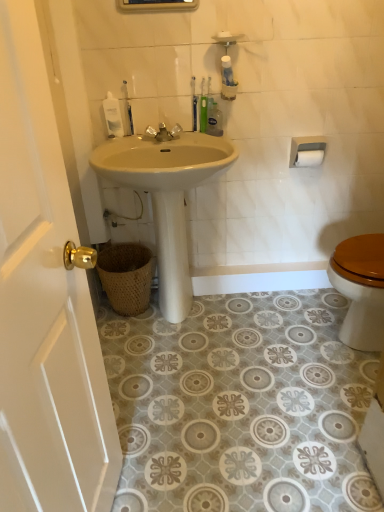
Find the location of a particular element. unoccupied region to the right of white plastic soap dispenser at upper center, which appears as the second toiletry when viewed from the left is located at coordinates click(x=159, y=138).